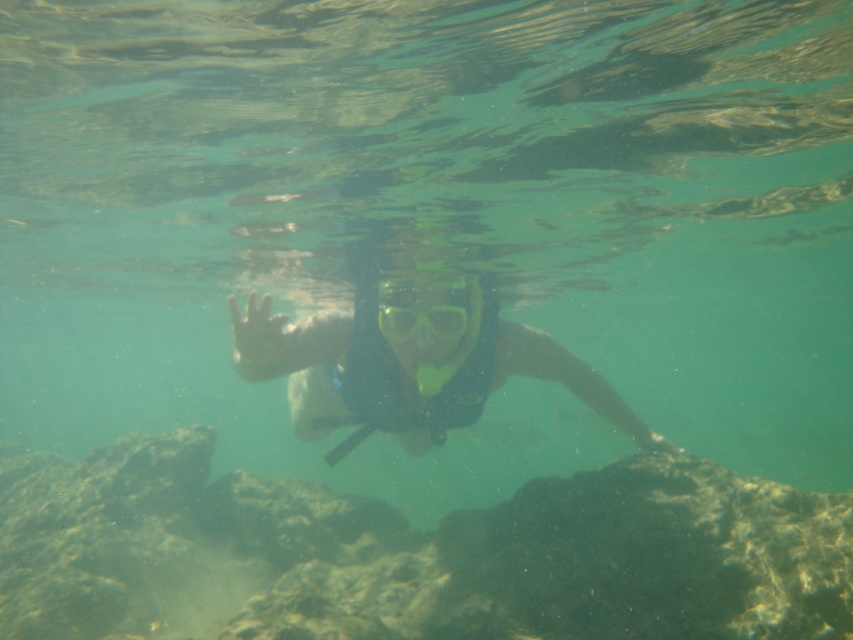
You are a snorkeler who wants to ensure their equipment is properly sized. You have a transparent rubber snorkel at center and transparent plastic goggles at center. Which equipment has a greater width?

The transparent rubber snorkel at center has a greater width than the transparent plastic goggles at center.

Looking at this image, you are a snorkeler who wants to ensure your gear is properly sized. You have a transparent rubber snorkel at center and transparent plastic goggles at center. Which of your gear items is larger in size?

The transparent rubber snorkel at center is larger in size compared to the transparent plastic goggles at center.

You are a marine biologist preparing to dive into the water. You see the transparent rubber snorkel at center floating in the water. If your reach is 20 feet, can you grab it without swimming closer?

The transparent rubber snorkel at center is 21.15 feet away from the viewer. Since your reach is only 20 feet, you cannot grab it without swimming closer.